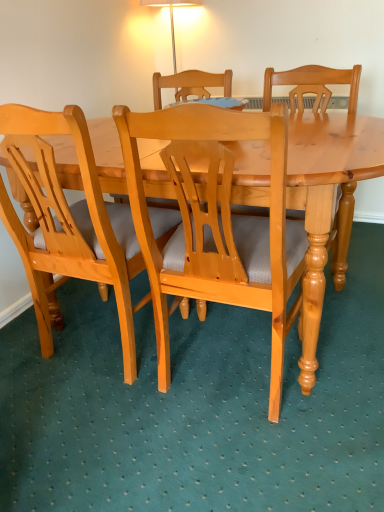
Question: From the image's perspective, is matte wood chair at center, the 2th chair in the right-to-left sequence, positioned above or below light brown wood chair at center, positioned as the first chair in right-to-left order?

Choices:
 (A) below
 (B) above

Answer: (B)

Question: Does point (26, 141) appear closer or farther from the camera than point (276, 388)?

Choices:
 (A) closer
 (B) farther

Answer: (A)

Question: Considering the relative positions of matte wood chair at center, which is the 1th chair from left to right, and light brown wood chair at center, positioned as the first chair in right-to-left order, in the image provided, is matte wood chair at center, which is the 1th chair from left to right, to the left or to the right of light brown wood chair at center, positioned as the first chair in right-to-left order,?

Choices:
 (A) right
 (B) left

Answer: (B)

Question: From the image's perspective, is light brown wood chair at center, placed as the second chair when sorted from left to right, above or below matte wood chair at center, which is the 1th chair from left to right?

Choices:
 (A) above
 (B) below

Answer: (B)

Question: Considering the positions of light brown wood chair at center, positioned as the first chair in right-to-left order, and matte wood chair at center, the 2th chair in the right-to-left sequence, in the image, is light brown wood chair at center, positioned as the first chair in right-to-left order, taller or shorter than matte wood chair at center, the 2th chair in the right-to-left sequence,?

Choices:
 (A) tall
 (B) short

Answer: (A)

Question: Would you say light brown wood chair at center, positioned as the first chair in right-to-left order, is to the left or to the right of matte wood chair at center, which is the 1th chair from left to right, in the picture?

Choices:
 (A) left
 (B) right

Answer: (B)

Question: Is point (231, 114) positioned closer to the camera than point (54, 285)?

Choices:
 (A) closer
 (B) farther

Answer: (A)